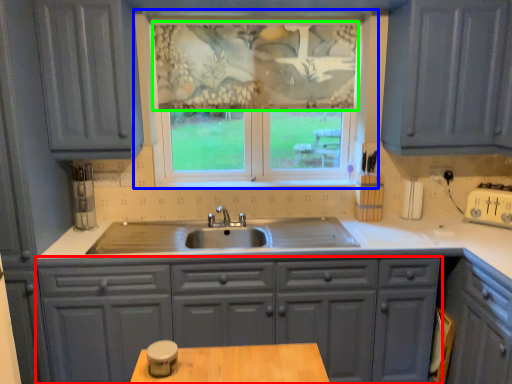
Question: Estimate the real-world distances between objects in this image. Which object is closer to cabinetry (highlighted by a red box), window (highlighted by a blue box) or curtain (highlighted by a green box)?

Choices:
 (A) window
 (B) curtain

Answer: (A)